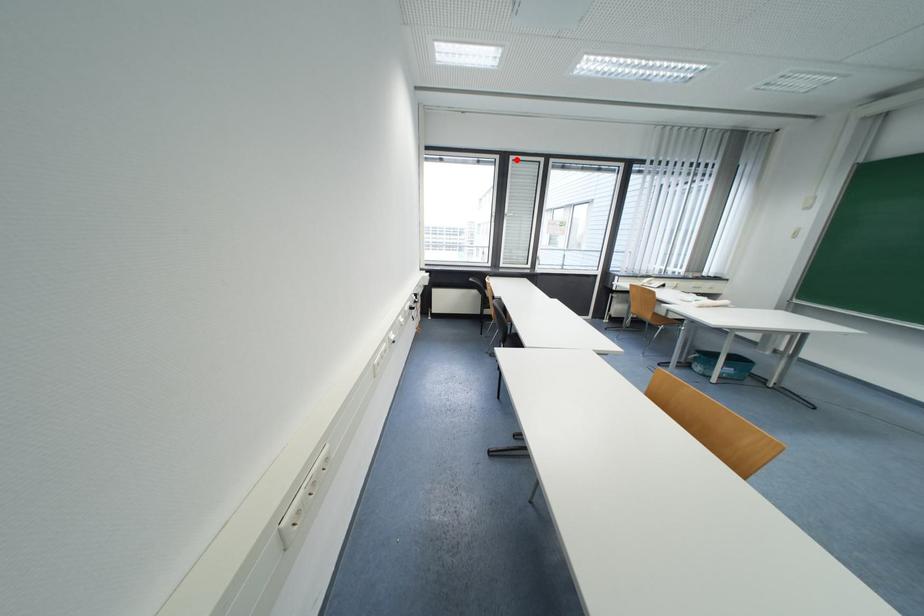
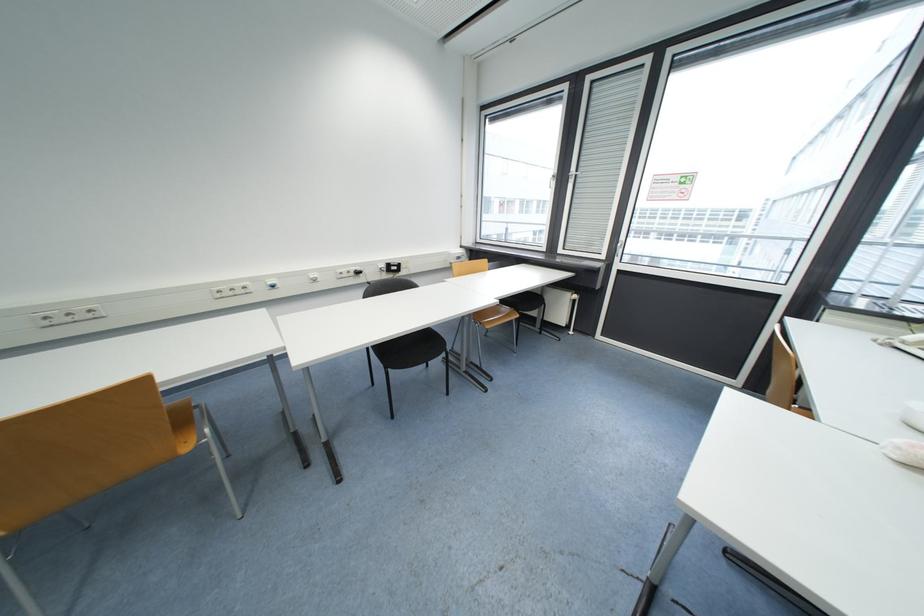
Locate, in the second image, the point that corresponds to the highlighted location in the first image.

(593, 81)